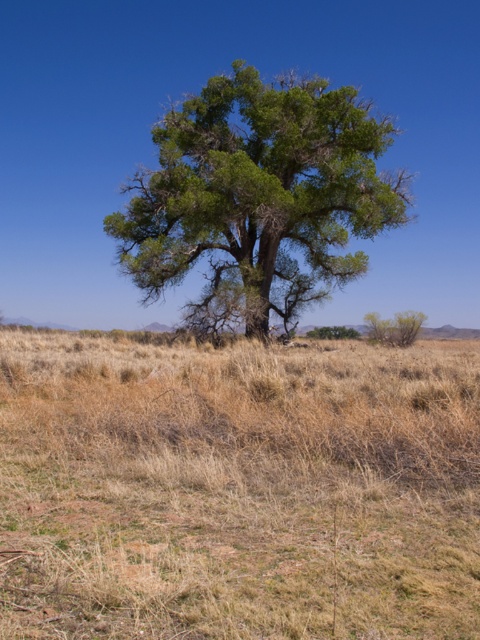
You are a hiker trying to find shade on a hot day. You see the dry grass at center and the green leafy tree at center. Which one provides more coverage for shade?

The green leafy tree at center provides more coverage for shade because it occupies more space than the dry grass at center.

You are a hiker trying to navigate through the dry grass at center and the green leafy tree at center. Which object is located to the right of the other?

The dry grass at center is positioned on the right side of green leafy tree at center.